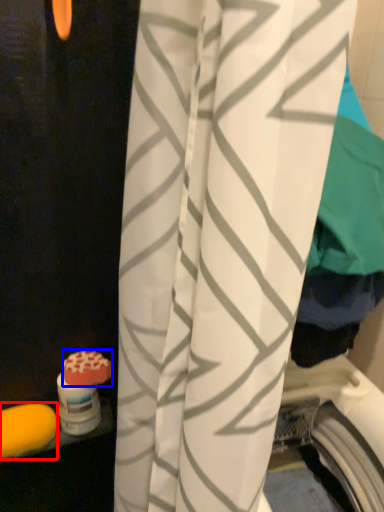
Question: Which of the following is the farthest to the observer, soap (highlighted by a red box) or soap (highlighted by a blue box)?

Choices:
 (A) soap
 (B) soap

Answer: (B)